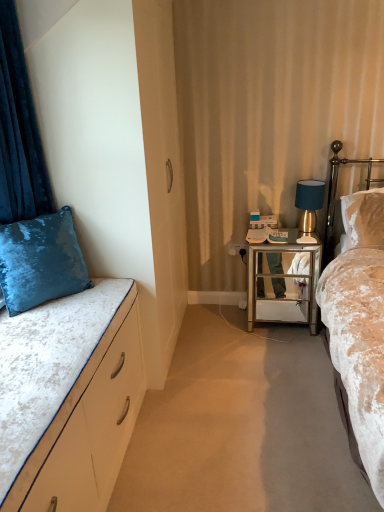
Where is `free space to the left of gold mirrored nightstand at right`? This screenshot has height=512, width=384. free space to the left of gold mirrored nightstand at right is located at coordinates (228, 326).